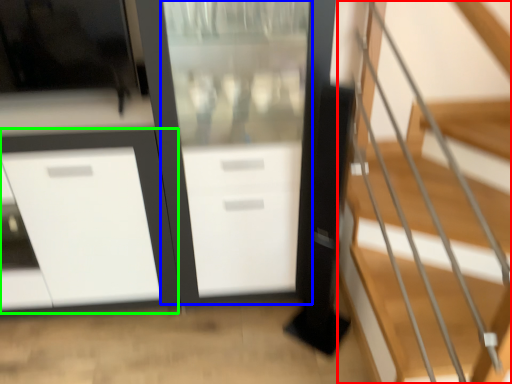
Question: Estimate the real-world distances between objects in this image. Which object is closer to stairs (highlighted by a red box), screen door (highlighted by a blue box) or cabinetry (highlighted by a green box)?

Choices:
 (A) screen door
 (B) cabinetry

Answer: (A)